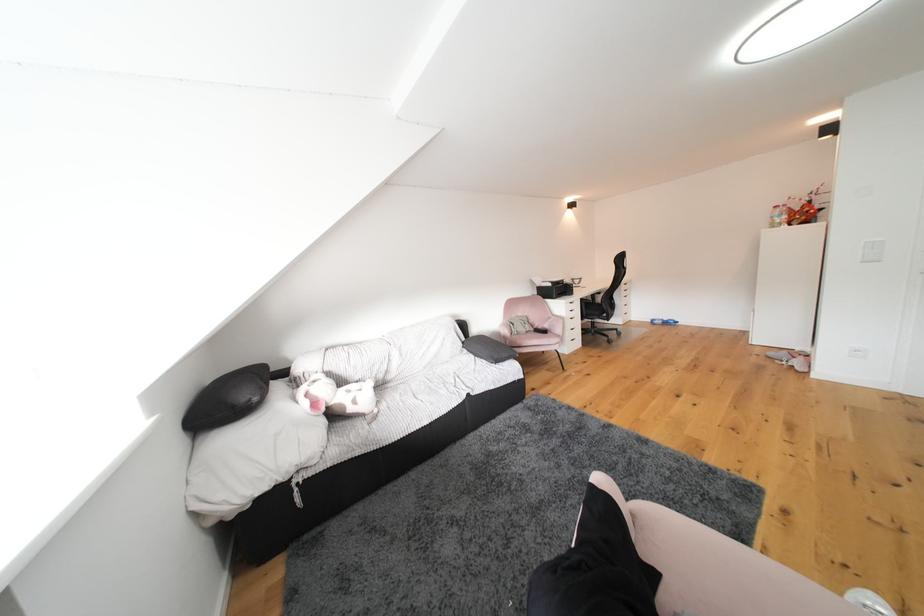
What do you see at coordinates (552, 286) in the screenshot? Image resolution: width=924 pixels, height=616 pixels. I see `a black printer` at bounding box center [552, 286].